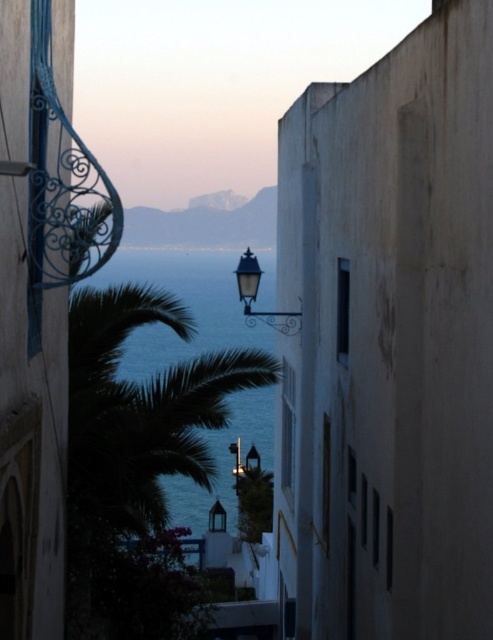
You are standing in the narrow alleyway between two buildings and see the blue water at center. There is a small dog that is 0.5 meters wide. Can the dog walk through the alleyway between the decorative wrought iron balcony railing on the left and the tall white wall on the right?

The alleyway between the decorative wrought iron balcony railing on the left and the tall white wall on the right is 15.98 meters apart. Since the dog is only 0.5 meters wide, it can easily walk through the alleyway between the decorative wrought iron balcony railing on the left and the tall white wall on the right.

You are a photographer standing in the narrow alleyway between the two buildings. You want to capture a photo that includes both the blue water at center and the polished brass streetlamp at center. Based on their positions, which object should appear larger in the photo?

The blue water at center is closer to the viewer than the polished brass streetlamp at center, so it should appear larger in the photo.

You are standing in the narrow alleyway between two buildings in a Mediterranean coastal town. You see two points marked on the ground ahead of you. The first point is at coordinates point (146, 512) and the second is at point (266, 310). If you want to walk towards the ocean, which point should you step on first?

Point (146, 512) is in front of point (266, 310), so you should step on point (146, 512) first to head towards the ocean.